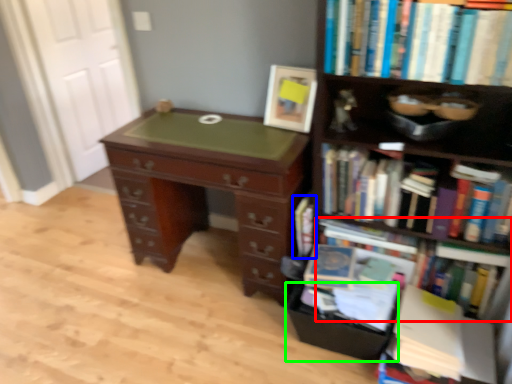
Question: Which object is the closest to the book (highlighted by a red box)? Choose among these: book (highlighted by a blue box) or drawer (highlighted by a green box).

Choices:
 (A) book
 (B) drawer

Answer: (A)